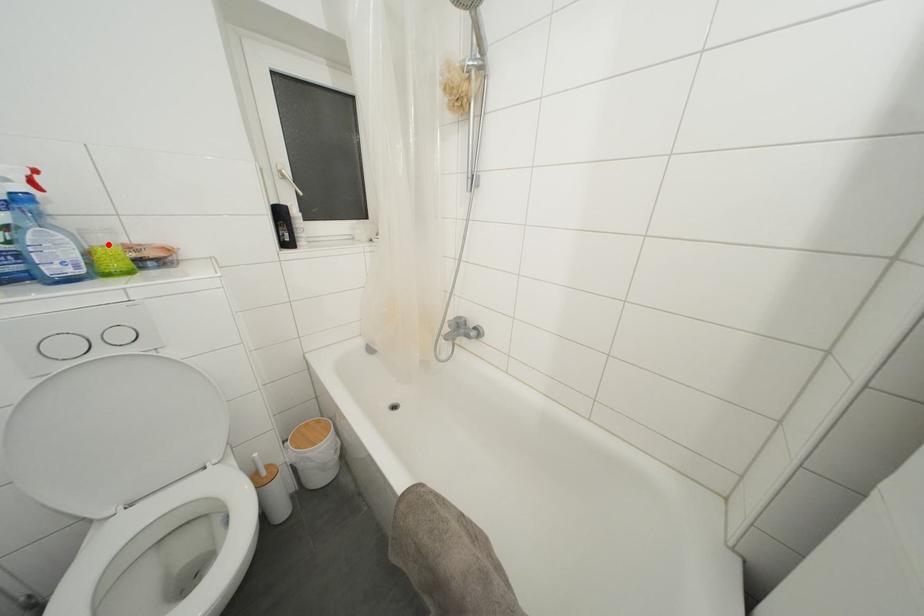
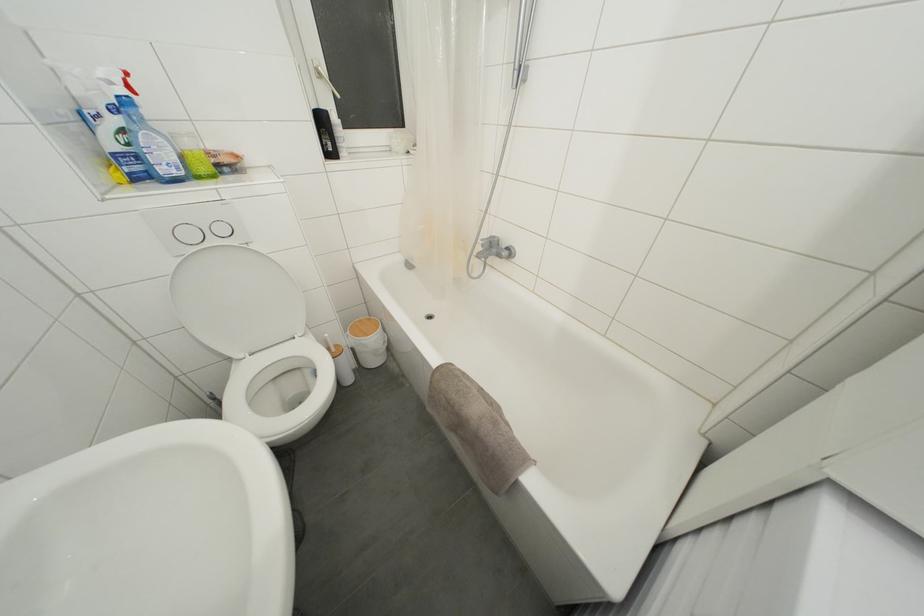
In the second image, find the point that corresponds to the highlighted location in the first image.

(193, 148)